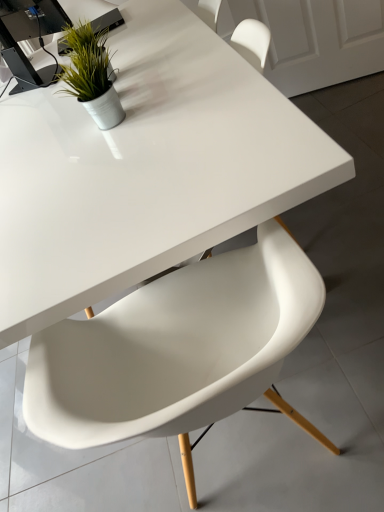
Question: Is white glossy table at center not near green matte plant at upper left?

Choices:
 (A) yes
 (B) no

Answer: (B)

Question: Could you tell me if white glossy table at center is turned towards green matte plant at upper left?

Choices:
 (A) no
 (B) yes

Answer: (A)

Question: Considering the relative sizes of white glossy table at center and green matte plant at upper left in the image provided, is white glossy table at center wider than green matte plant at upper left?

Choices:
 (A) yes
 (B) no

Answer: (A)

Question: Is white glossy table at center bigger than green matte plant at upper left?

Choices:
 (A) yes
 (B) no

Answer: (A)

Question: Does white glossy table at center appear on the left side of green matte plant at upper left?

Choices:
 (A) yes
 (B) no

Answer: (B)

Question: Is green matte plant at upper left a part of white glossy table at center?

Choices:
 (A) yes
 (B) no

Answer: (B)

Question: Is white plastic chair at center not near white glossy table at center?

Choices:
 (A) no
 (B) yes

Answer: (A)

Question: Is white plastic chair at center positioned with its back to white glossy table at center?

Choices:
 (A) no
 (B) yes

Answer: (A)

Question: From the image's perspective, is white plastic chair at center beneath white glossy table at center?

Choices:
 (A) no
 (B) yes

Answer: (B)

Question: Is white plastic chair at center to the right of white glossy table at center from the viewer's perspective?

Choices:
 (A) yes
 (B) no

Answer: (A)

Question: Is white plastic chair at center bigger than white glossy table at center?

Choices:
 (A) yes
 (B) no

Answer: (B)

Question: Is white plastic chair at center oriented towards white glossy table at center?

Choices:
 (A) yes
 (B) no

Answer: (A)

Question: Can you confirm if white glossy table at center is taller than white plastic chair at center?

Choices:
 (A) no
 (B) yes

Answer: (A)